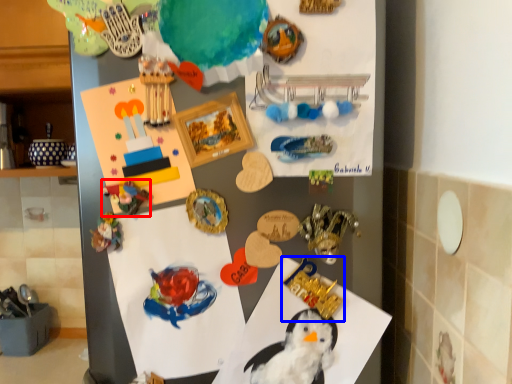
Question: Which object is further to the camera taking this photo, art (highlighted by a red box) or toy (highlighted by a blue box)?

Choices:
 (A) art
 (B) toy

Answer: (B)